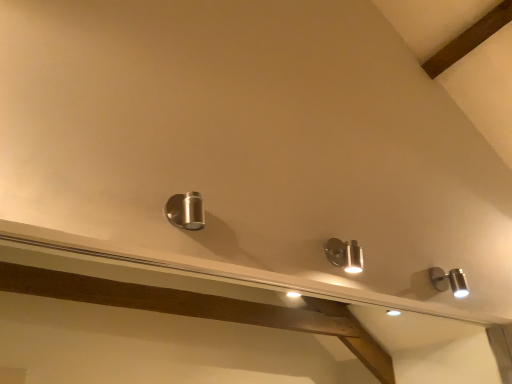
Image resolution: width=512 pixels, height=384 pixels. In order to click on satin silver lamp at upper right in this screenshot , I will do `click(449, 281)`.

Describe the element at coordinates (449, 281) in the screenshot. The image size is (512, 384). I see `satin silver lamp at upper right` at that location.

Measure the distance between satin silver lamp at upper right and camera.

A distance of 1.55 meters exists between satin silver lamp at upper right and camera.

Locate an element on the screen. This screenshot has height=384, width=512. satin silver lamp at upper right is located at coordinates (449, 281).